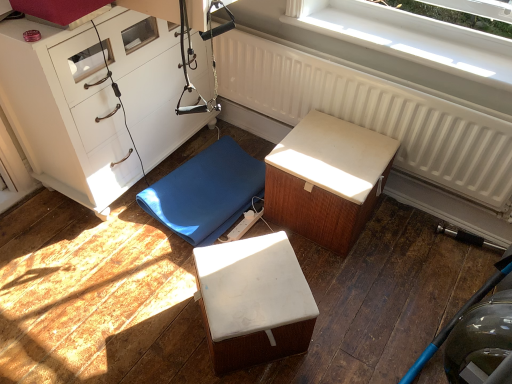
Question: From the image's perspective, is white textured radiator at upper center above white textured cushion at center, which is the third furniture from left to right?

Choices:
 (A) yes
 (B) no

Answer: (A)

Question: Is white textured radiator at upper center positioned behind white textured cushion at center, which is the third furniture from left to right?

Choices:
 (A) yes
 (B) no

Answer: (B)

Question: Is white textured radiator at upper center facing towards white textured cushion at center, which ranks as the first furniture in right-to-left order?

Choices:
 (A) yes
 (B) no

Answer: (A)

Question: Is white textured radiator at upper center smaller than white textured cushion at center, which is the third furniture from left to right?

Choices:
 (A) yes
 (B) no

Answer: (A)

Question: Can you confirm if white textured radiator at upper center is positioned to the left of white textured cushion at center, which ranks as the first furniture in right-to-left order?

Choices:
 (A) no
 (B) yes

Answer: (A)

Question: Looking at the image, does white textured radiator at upper center seem bigger or smaller compared to white matte cube at center, placed as the 2th furniture when sorted from left to right?

Choices:
 (A) small
 (B) big

Answer: (B)

Question: Considering the positions of white textured radiator at upper center and white matte cube at center, the 2th furniture in the right-to-left sequence, in the image, is white textured radiator at upper center wider or thinner than white matte cube at center, the 2th furniture in the right-to-left sequence,?

Choices:
 (A) thin
 (B) wide

Answer: (A)

Question: Is white textured radiator at upper center spatially inside white matte cube at center, placed as the 2th furniture when sorted from left to right, or outside of it?

Choices:
 (A) inside
 (B) outside

Answer: (B)

Question: From the image's perspective, is white textured radiator at upper center above or below white matte cube at center, placed as the 2th furniture when sorted from left to right?

Choices:
 (A) above
 (B) below

Answer: (A)

Question: From the image's perspective, is white plastic window at upper center positioned above or below white textured cushion at center, which is the third furniture from left to right?

Choices:
 (A) below
 (B) above

Answer: (B)

Question: From their relative heights in the image, would you say white plastic window at upper center is taller or shorter than white textured cushion at center, which is the third furniture from left to right?

Choices:
 (A) tall
 (B) short

Answer: (B)

Question: In terms of size, does white plastic window at upper center appear bigger or smaller than white textured cushion at center, which ranks as the first furniture in right-to-left order?

Choices:
 (A) small
 (B) big

Answer: (A)

Question: Is white plastic window at upper center wider or thinner than white textured cushion at center, which ranks as the first furniture in right-to-left order?

Choices:
 (A) thin
 (B) wide

Answer: (A)

Question: Would you say white plastic window at upper center is to the left or to the right of blue rubber mat at center, the third furniture when ordered from right to left, in the picture?

Choices:
 (A) left
 (B) right

Answer: (B)

Question: Which is correct: white plastic window at upper center is inside blue rubber mat at center, the third furniture when ordered from right to left, or outside of it?

Choices:
 (A) outside
 (B) inside

Answer: (A)